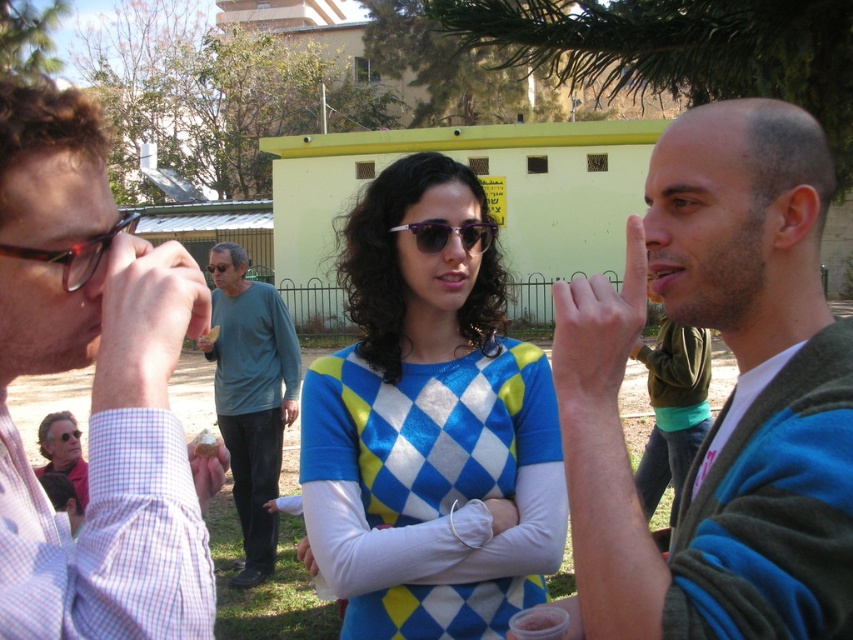
Question: Which object is farther from the camera taking this photo?

Choices:
 (A) teal jersey at center
 (B) matte skin hand at center

Answer: (A)

Question: Is teal jersey at center positioned before translucent plastic glasses at left?

Choices:
 (A) yes
 (B) no

Answer: (B)

Question: Is matte black glasses at upper left above matte black sunglasses at center?

Choices:
 (A) yes
 (B) no

Answer: (B)

Question: Where is blue sweater at center located in relation to matte black sunglasses at center in the image?

Choices:
 (A) above
 (B) below

Answer: (B)

Question: Considering the real-world distances, which object is farthest from the argyle sweater at center?

Choices:
 (A) matte black glasses at upper left
 (B) matte black sunglasses at center

Answer: (B)

Question: Which object is farther from the camera taking this photo?

Choices:
 (A) matte brown cookie at lower left
 (B) purple acetate sunglasses at center
 (C) blue sweater at center

Answer: (B)